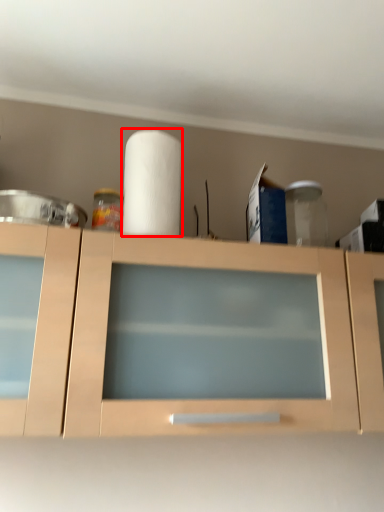
Question: Where is paper towel (annotated by the red box) located in relation to cabinetry in the image?

Choices:
 (A) right
 (B) left

Answer: (B)